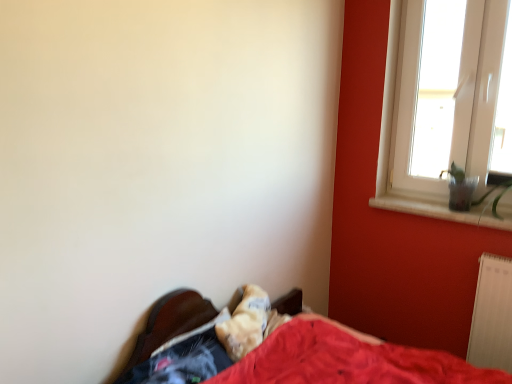
You are a GUI agent. You are given a task and a screenshot of the screen. Output one action in this format:
    pyautogui.click(x=<x>, y=<y>)
    Task: Click on the vacant space situated above white marble window sill at right (from a real-world perspective)
    
    Given the screenshot: What is the action you would take?
    pyautogui.click(x=461, y=209)